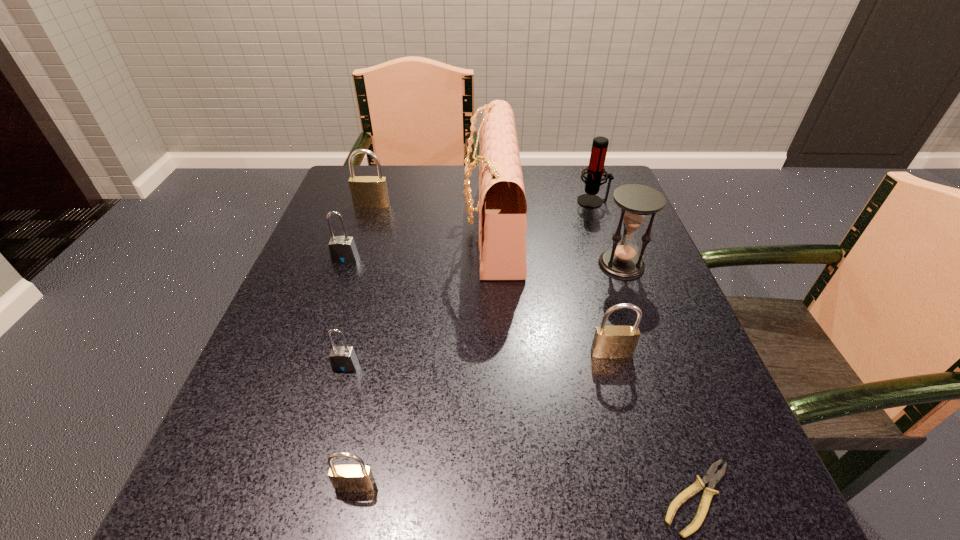
Locate an element on the screen. This screenshot has width=960, height=540. handbag is located at coordinates (502, 207).

Find the location of a particular element. The width and height of the screenshot is (960, 540). the tallest object is located at coordinates (502, 207).

Where is `microphone`? microphone is located at coordinates (595, 170).

You are a GUI agent. You are given a task and a screenshot of the screen. Output one action in this format:
    pyautogui.click(x=<x>, y=<y>)
    Task: Click on the hourglass
    The width and height of the screenshot is (960, 540).
    Given the screenshot: What is the action you would take?
    pyautogui.click(x=637, y=202)

At what (x,y) coordinates should I click in order to perform the action: click on the tallest padlock. Please return your answer as a coordinate pair (x, y). This screenshot has width=960, height=540. Looking at the image, I should click on (367, 191).

At what (x,y) coordinates should I click in order to perform the action: click on the farthest padlock. Please return your answer as a coordinate pair (x, y). This screenshot has height=540, width=960. Looking at the image, I should click on (367, 191).

Find the location of a particular element. Image resolution: width=960 pixels, height=540 pixels. the second farthest padlock is located at coordinates (342, 249).

Image resolution: width=960 pixels, height=540 pixels. I want to click on the bigger gray padlock, so click(342, 249).

Locate an element on the screen. the rightmost brass padlock is located at coordinates (609, 341).

Where is `the second biggest brass padlock`? the second biggest brass padlock is located at coordinates (609, 341).